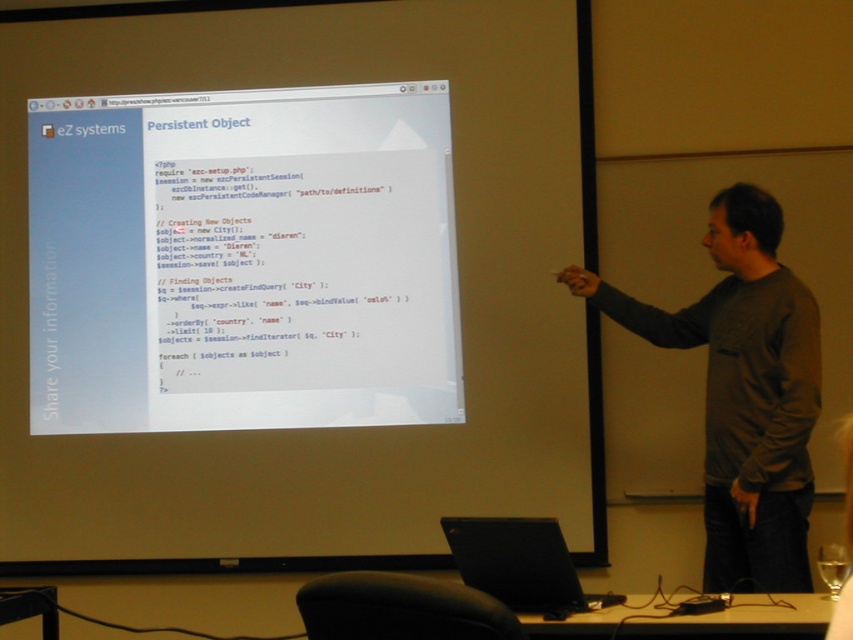
Question: Does gray cotton shirt at right appear on the right side of black matte laptop at lower center?

Choices:
 (A) no
 (B) yes

Answer: (B)

Question: Is white glossy projector screen at upper center smaller than black matte laptop at lower center?

Choices:
 (A) no
 (B) yes

Answer: (A)

Question: Considering the real-world distances, which object is closest to the clear glass at lower right?

Choices:
 (A) clear glass at upper right
 (B) gray cotton shirt at right
 (C) white glossy projector screen at upper center
 (D) black matte laptop at lower center

Answer: (B)

Question: Which point appears farthest from the camera in this image?

Choices:
 (A) (550, 604)
 (B) (846, 572)
 (C) (743, 556)
 (D) (428, 362)

Answer: (D)

Question: Among these objects, which one is nearest to the camera?

Choices:
 (A) gray cotton shirt at right
 (B) clear glass at upper right

Answer: (B)

Question: Is white glossy projector screen at upper center wider than black matte laptop at lower center?

Choices:
 (A) no
 (B) yes

Answer: (B)